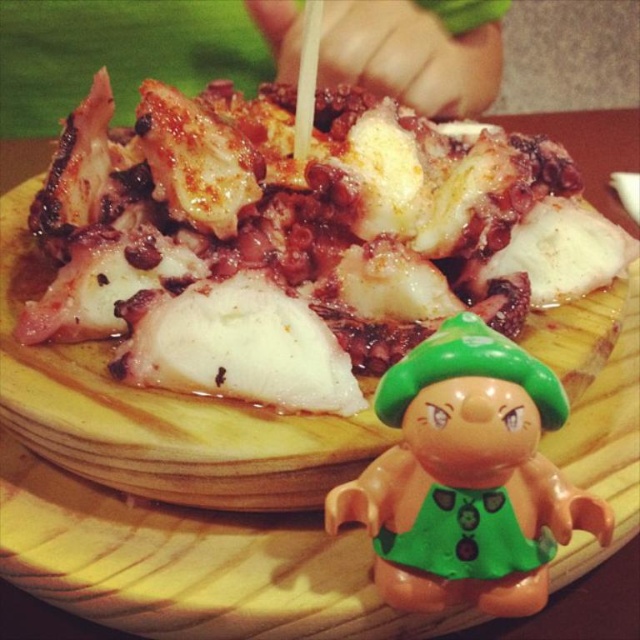
Question: Is slightly charred octopus at center thinner than green plastic toy at lower right?

Choices:
 (A) no
 (B) yes

Answer: (A)

Question: Does slightly charred octopus at center appear under green plastic toy at lower right?

Choices:
 (A) no
 (B) yes

Answer: (A)

Question: Which of the following is the closest to the observer?

Choices:
 (A) green plastic toy at lower right
 (B) slightly charred octopus at center

Answer: (A)

Question: Is slightly charred octopus at center wider than green plastic toy at lower right?

Choices:
 (A) yes
 (B) no

Answer: (A)